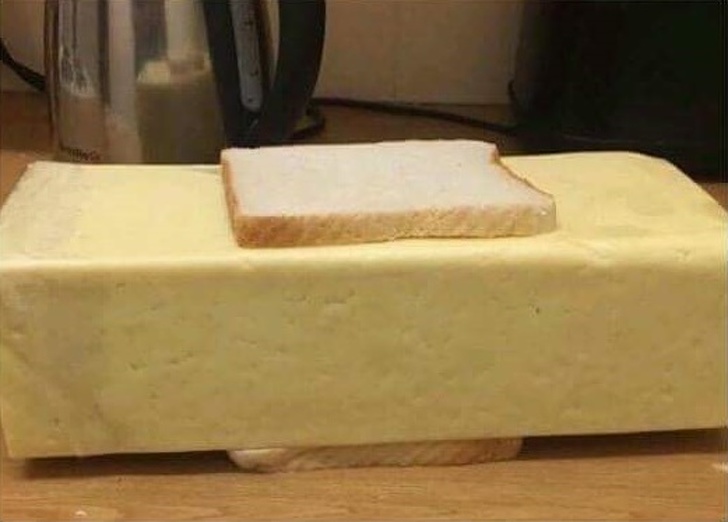
Locate an element on the screen. Image resolution: width=728 pixels, height=522 pixels. walls is located at coordinates (389, 33), (27, 30).